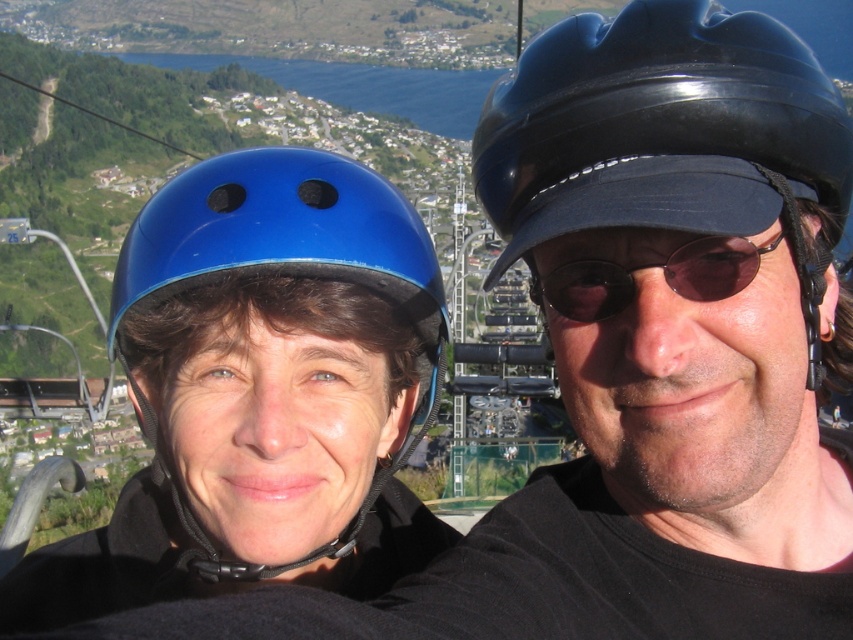
Can you confirm if blue matte helmet at left is thinner than sunglasses at center?

No.

Which of these two, blue matte helmet at left or sunglasses at center, stands taller?

Standing taller between the two is blue matte helmet at left.

The width and height of the screenshot is (853, 640). I want to click on blue matte helmet at left, so click(287, 253).

Based on the photo, is black glossy helmet at upper center behind sunglasses at center?

No, black glossy helmet at upper center is closer to the viewer.

Based on the photo, which is below, black glossy helmet at upper center or sunglasses at center?

sunglasses at center

Which is behind, point (547, 218) or point (612, 275)?

Point (612, 275)

Where is `black glossy helmet at upper center`? This screenshot has height=640, width=853. black glossy helmet at upper center is located at coordinates (660, 129).

Consider the image. Does black glossy helmet at upper center lie behind blue matte helmet at left?

No, black glossy helmet at upper center is in front of blue matte helmet at left.

Between point (677, 109) and point (157, 250), which one is positioned in front?

Positioned in front is point (677, 109).

Where is `black glossy helmet at upper center`? black glossy helmet at upper center is located at coordinates (660, 129).